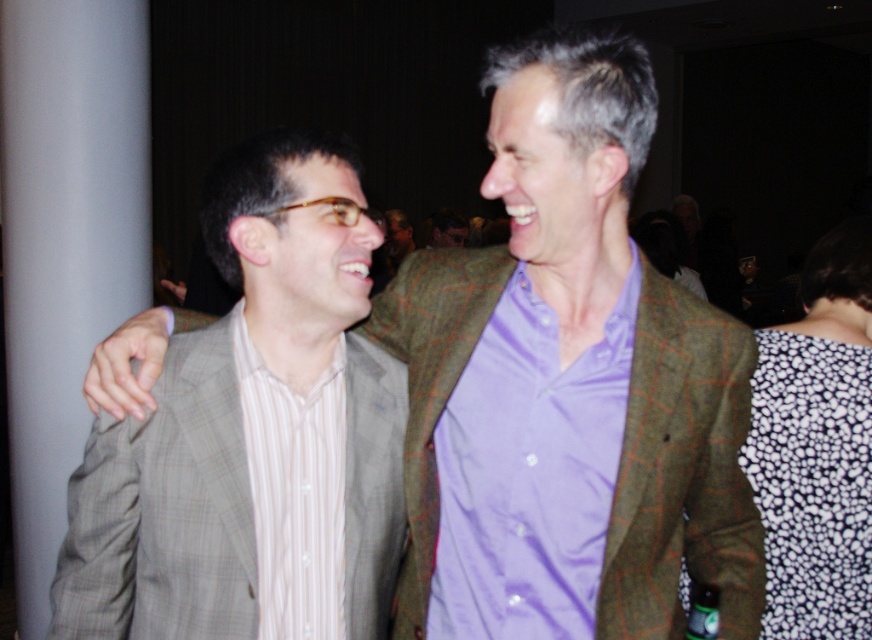
Can you confirm if matte gray suit at center is wider than lavender satin shirt at center?

Yes.

Is matte gray suit at center to the left of lavender satin shirt at center from the viewer's perspective?

No, matte gray suit at center is not to the left of lavender satin shirt at center.

The width and height of the screenshot is (872, 640). What do you see at coordinates (569, 385) in the screenshot?
I see `matte gray suit at center` at bounding box center [569, 385].

The height and width of the screenshot is (640, 872). Find the location of `matte gray suit at center`. matte gray suit at center is located at coordinates (569, 385).

Is lavender satin shirt at center positioned before white striped shirt at left?

No, it is not.

Who is more forward, (552, 323) or (322, 589)?

Point (552, 323)

The height and width of the screenshot is (640, 872). Identify the location of lavender satin shirt at center. (529, 472).

Is matte gray suit at center thinner than white striped shirt at left?

No, matte gray suit at center is not thinner than white striped shirt at left.

Which of these two, matte gray suit at center or white striped shirt at left, stands shorter?

white striped shirt at left

Does point (461, 468) lie behind point (269, 468)?

Yes.

This screenshot has width=872, height=640. I want to click on matte gray suit at center, so click(569, 385).